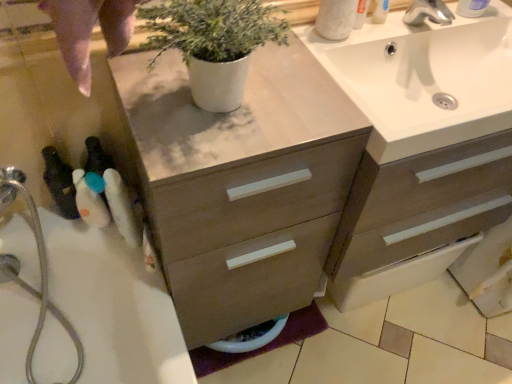
At what (x,y) coordinates should I click in order to perform the action: click on vacant space that is to the left of white glossy pot at center. Please return your answer as a coordinate pair (x, y). Looking at the image, I should click on (155, 98).